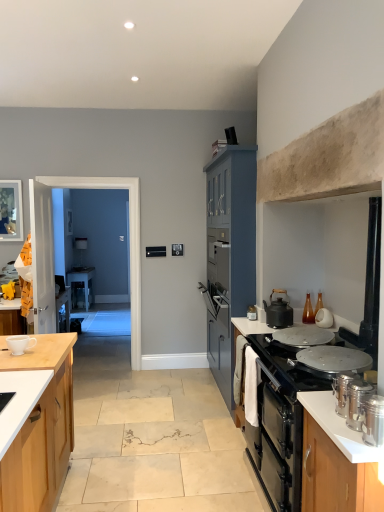
Question: Is the depth of wooden picture frame at left less than that of white ceramic cup at left?

Choices:
 (A) no
 (B) yes

Answer: (A)

Question: Does wooden picture frame at left turn towards white ceramic cup at left?

Choices:
 (A) no
 (B) yes

Answer: (A)

Question: From a real-world perspective, is wooden picture frame at left positioned over white ceramic cup at left based on gravity?

Choices:
 (A) no
 (B) yes

Answer: (B)

Question: Is wooden picture frame at left not within white ceramic cup at left?

Choices:
 (A) no
 (B) yes

Answer: (B)

Question: Can you confirm if wooden picture frame at left is positioned to the right of white ceramic cup at left?

Choices:
 (A) no
 (B) yes

Answer: (A)

Question: Is wooden picture frame at left turned away from white ceramic cup at left?

Choices:
 (A) no
 (B) yes

Answer: (A)

Question: Is matte blue cabinet at center, the 1th cabinetry when ordered from back to front, to the right of matte black kettle at right, the third kitchen appliance positioned from the front, from the viewer's perspective?

Choices:
 (A) no
 (B) yes

Answer: (A)

Question: Is matte blue cabinet at center, the 1th cabinetry when ordered from back to front, taller than matte black kettle at right, marked as the second kitchen appliance in a back-to-front arrangement?

Choices:
 (A) no
 (B) yes

Answer: (B)

Question: From a real-world perspective, is matte blue cabinet at center, the 1th cabinetry when ordered from back to front, located higher than matte black kettle at right, the third kitchen appliance positioned from the front?

Choices:
 (A) no
 (B) yes

Answer: (B)

Question: Is matte blue cabinet at center, which is counted as the 2th cabinetry, starting from the front, smaller than matte black kettle at right, the third kitchen appliance positioned from the front?

Choices:
 (A) yes
 (B) no

Answer: (B)

Question: Would you say matte blue cabinet at center, the 1th cabinetry when ordered from back to front, contains matte black kettle at right, marked as the second kitchen appliance in a back-to-front arrangement?

Choices:
 (A) yes
 (B) no

Answer: (B)

Question: Is matte blue cabinet at center, the 1th cabinetry when ordered from back to front, thinner than matte black kettle at right, marked as the second kitchen appliance in a back-to-front arrangement?

Choices:
 (A) no
 (B) yes

Answer: (A)

Question: Is black plastic phone at upper center placed right next to white glossy countertop at right, acting as the second countertop starting from the top?

Choices:
 (A) no
 (B) yes

Answer: (A)